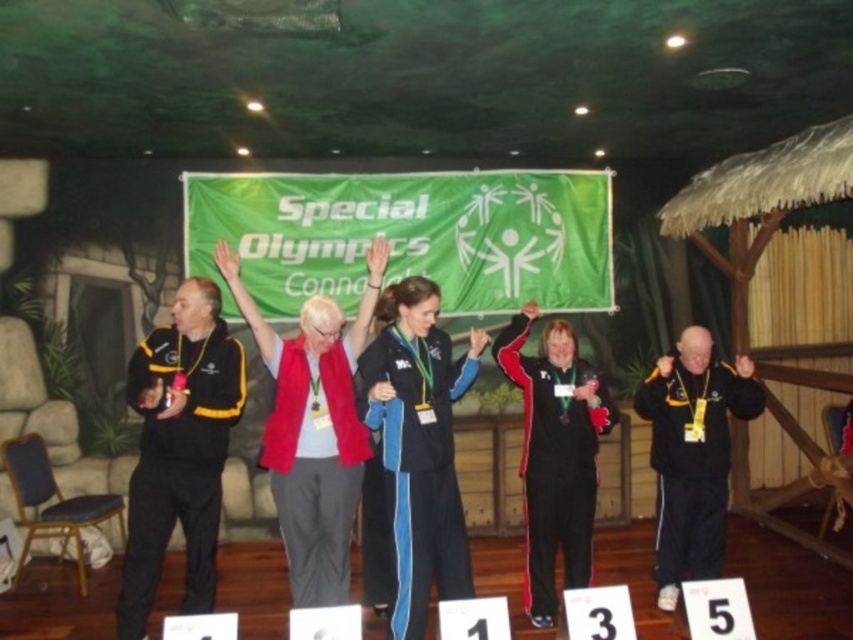
Looking at this image, between black fabric jacket at left and black matte jacket at right, which one appears on the left side from the viewer's perspective?

black fabric jacket at left

Consider the image. Does black fabric jacket at left lie in front of black matte jacket at right?

Yes, black fabric jacket at left is in front of black matte jacket at right.

Which is in front, point (228, 388) or point (695, 493)?

Point (228, 388)

Identify the location of black fabric jacket at left. The height and width of the screenshot is (640, 853). click(178, 451).

Looking at this image, which is below, red fabric jacket at center or black track suit at center?

black track suit at center is below.

Is point (312, 529) closer to camera compared to point (610, 403)?

Yes, it is in front of point (610, 403).

Identify the location of red fabric jacket at center. This screenshot has height=640, width=853. (312, 429).

Does black fabric jacket at left have a lesser height compared to blue track suit at center?

No.

Is black fabric jacket at left to the left of blue track suit at center from the viewer's perspective?

Indeed, black fabric jacket at left is positioned on the left side of blue track suit at center.

Is point (192, 566) farther from camera compared to point (415, 486)?

That is True.

Locate an element on the screen. black fabric jacket at left is located at coordinates (178, 451).